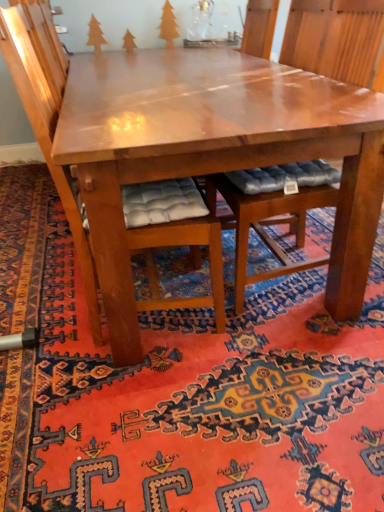
Locate an element on the screen. This screenshot has height=512, width=384. wooden cushioned chair at center, arranged as the first chair when viewed from the right is located at coordinates (334, 37).

Describe the element at coordinates (214, 152) in the screenshot. I see `shiny brown table at center` at that location.

In order to click on wooden tree at upper left, the third tree when ordered from right to left in this screenshot , I will do `click(95, 35)`.

Is carpet with intricate patterns at center bigger or smaller than wooden tree at upper left, the third tree when ordered from right to left?

Clearly, carpet with intricate patterns at center is larger in size than wooden tree at upper left, the third tree when ordered from right to left.

From a real-world perspective, which object stands above the other?

wooden tree at upper left, which is the first tree in left-to-right order, from a real-world perspective.

Is carpet with intricate patterns at center positioned with its back to wooden tree at upper left, which is the first tree in left-to-right order?

That's not correct — carpet with intricate patterns at center is not looking away from wooden tree at upper left, which is the first tree in left-to-right order.

From the image's perspective, is carpet with intricate patterns at center positioned above or below wooden tree at upper left, the third tree when ordered from right to left?

carpet with intricate patterns at center is situated lower than wooden tree at upper left, the third tree when ordered from right to left, in the image.

Considering the relative sizes of matte brown tree at upper center, the 2th tree from the right, and wooden cushioned chair at center, arranged as the first chair when viewed from the right, in the image provided, is matte brown tree at upper center, the 2th tree from the right, bigger than wooden cushioned chair at center, arranged as the first chair when viewed from the right,?

No, matte brown tree at upper center, the 2th tree from the right, is not bigger than wooden cushioned chair at center, arranged as the first chair when viewed from the right.

Is matte brown tree at upper center, which ranks as the second tree in left-to-right order, next to wooden cushioned chair at center, arranged as the first chair when viewed from the right, and touching it?

No, matte brown tree at upper center, which ranks as the second tree in left-to-right order, is not touching wooden cushioned chair at center, arranged as the first chair when viewed from the right.

Which object is further away from the camera taking this photo, matte brown tree at upper center, the 2th tree from the right, or wooden cushioned chair at center, arranged as the first chair when viewed from the right?

matte brown tree at upper center, the 2th tree from the right, is behind.

Is matte brown tree at upper center, which ranks as the second tree in left-to-right order, to the left of wooden cushioned chair at center, arranged as the first chair when viewed from the right, from the viewer's perspective?

Yes, matte brown tree at upper center, which ranks as the second tree in left-to-right order, is to the left of wooden cushioned chair at center, arranged as the first chair when viewed from the right.

Is wooden tree at upper left, the third tree when ordered from right to left, in contact with orange matte tree at upper center, arranged as the first tree when viewed from the right?

No.

Image resolution: width=384 pixels, height=512 pixels. I want to click on tree that is the 2nd object to the right of the wooden tree at upper left, the third tree when ordered from right to left, starting at the anchor, so click(168, 26).

How different are the orientations of wooden tree at upper left, the third tree when ordered from right to left, and orange matte tree at upper center, positioned as the third tree in left-to-right order, in degrees?

The angular difference between wooden tree at upper left, the third tree when ordered from right to left, and orange matte tree at upper center, positioned as the third tree in left-to-right order, is 12 degrees.

Which of these two, wooden tree at upper left, which is the first tree in left-to-right order, or orange matte tree at upper center, positioned as the third tree in left-to-right order, stands taller?

With more height is orange matte tree at upper center, positioned as the third tree in left-to-right order.

Where is `tree to the right of matte brown tree at upper center, the 2th tree from the right`? The width and height of the screenshot is (384, 512). tree to the right of matte brown tree at upper center, the 2th tree from the right is located at coordinates (168, 26).

Can you confirm if orange matte tree at upper center, positioned as the third tree in left-to-right order, is wider than matte brown tree at upper center, which ranks as the second tree in left-to-right order?

Indeed, orange matte tree at upper center, positioned as the third tree in left-to-right order, has a greater width compared to matte brown tree at upper center, which ranks as the second tree in left-to-right order.

Can you confirm if orange matte tree at upper center, arranged as the first tree when viewed from the right, is smaller than matte brown tree at upper center, which ranks as the second tree in left-to-right order?

Actually, orange matte tree at upper center, arranged as the first tree when viewed from the right, might be larger than matte brown tree at upper center, which ranks as the second tree in left-to-right order.

Consider the image. What's the angular difference between wooden cushioned chair at center, which appears as the 2th chair when viewed from the left, and matte brown tree at upper center, the 2th tree from the right,'s facing directions?

There is a 90-degree angle between the facing directions of wooden cushioned chair at center, which appears as the 2th chair when viewed from the left, and matte brown tree at upper center, the 2th tree from the right.

Is wooden cushioned chair at center, arranged as the first chair when viewed from the right, far from matte brown tree at upper center, the 2th tree from the right?

Yes, wooden cushioned chair at center, arranged as the first chair when viewed from the right, is far from matte brown tree at upper center, the 2th tree from the right.

Which point is more distant from viewer, (300, 240) or (133, 40)?

Positioned behind is point (133, 40).

Who is bigger, wooden cushioned chair at center, arranged as the first chair when viewed from the right, or matte brown tree at upper center, which ranks as the second tree in left-to-right order?

wooden cushioned chair at center, arranged as the first chair when viewed from the right.

Find the location of `the 1st chair to the right of the wooden tree at upper left, the third tree when ordered from right to left, starting your count from the anchor`. the 1st chair to the right of the wooden tree at upper left, the third tree when ordered from right to left, starting your count from the anchor is located at coordinates (48, 118).

Can you tell me how much wooden tree at upper left, the third tree when ordered from right to left, and wooden cushioned chair at center, acting as the second chair starting from the right, differ in facing direction?

82.3 degrees.

Is wooden tree at upper left, the third tree when ordered from right to left, positioned before wooden cushioned chair at center, acting as the second chair starting from the right?

No, the depth of wooden tree at upper left, the third tree when ordered from right to left, is greater than that of wooden cushioned chair at center, acting as the second chair starting from the right.

Between point (98, 37) and point (58, 110), which one is positioned behind?

The point (98, 37) is farther from the camera.

Between matte brown tree at upper center, which ranks as the second tree in left-to-right order, and orange matte tree at upper center, arranged as the first tree when viewed from the right, which one has more height?

orange matte tree at upper center, arranged as the first tree when viewed from the right, is taller.

Is orange matte tree at upper center, arranged as the first tree when viewed from the right, inside matte brown tree at upper center, the 2th tree from the right?

That's incorrect, orange matte tree at upper center, arranged as the first tree when viewed from the right, is not inside matte brown tree at upper center, the 2th tree from the right.

Considering the relative sizes of matte brown tree at upper center, which ranks as the second tree in left-to-right order, and orange matte tree at upper center, positioned as the third tree in left-to-right order, in the image provided, is matte brown tree at upper center, which ranks as the second tree in left-to-right order, thinner than orange matte tree at upper center, positioned as the third tree in left-to-right order,?

Correct, the width of matte brown tree at upper center, which ranks as the second tree in left-to-right order, is less than that of orange matte tree at upper center, positioned as the third tree in left-to-right order.

Between point (124, 37) and point (160, 26), which one is positioned in front?

Positioned in front is point (124, 37).

Image resolution: width=384 pixels, height=512 pixels. Find the location of `mat below the wooden tree at upper left, which is the first tree in left-to-right order (from a real-world perspective)`. mat below the wooden tree at upper left, which is the first tree in left-to-right order (from a real-world perspective) is located at coordinates (182, 388).

Image resolution: width=384 pixels, height=512 pixels. In order to click on the 1st chair below when counting from the matte brown tree at upper center, which ranks as the second tree in left-to-right order (from the image's perspective) in this screenshot , I will do `click(334, 37)`.

From the image, which object appears to be nearer to carpet with intricate patterns at center, wooden cushioned chair at center, which appears as the 2th chair when viewed from the left, or shiny brown table at center?

wooden cushioned chair at center, which appears as the 2th chair when viewed from the left, is closer to carpet with intricate patterns at center.

Which object lies nearer to the anchor point matte brown tree at upper center, the 2th tree from the right, wooden cushioned chair at center, acting as the second chair starting from the right, or orange matte tree at upper center, positioned as the third tree in left-to-right order?

Among the two, orange matte tree at upper center, positioned as the third tree in left-to-right order, is located nearer to matte brown tree at upper center, the 2th tree from the right.

Consider the image. When comparing their distances from wooden cushioned chair at center, the first chair in the left-to-right sequence, does matte brown tree at upper center, the 2th tree from the right, or carpet with intricate patterns at center seem further?

matte brown tree at upper center, the 2th tree from the right, is further to wooden cushioned chair at center, the first chair in the left-to-right sequence.

Estimate the real-world distances between objects in this image. Which object is further from orange matte tree at upper center, arranged as the first tree when viewed from the right, wooden tree at upper left, which is the first tree in left-to-right order, or wooden cushioned chair at center, arranged as the first chair when viewed from the right?

wooden cushioned chair at center, arranged as the first chair when viewed from the right, is positioned further to the anchor orange matte tree at upper center, arranged as the first tree when viewed from the right.

Looking at the image, which one is located further to wooden cushioned chair at center, the first chair in the left-to-right sequence, wooden cushioned chair at center, which appears as the 2th chair when viewed from the left, or shiny brown table at center?

Based on the image, wooden cushioned chair at center, which appears as the 2th chair when viewed from the left, appears to be further to wooden cushioned chair at center, the first chair in the left-to-right sequence.

Estimate the real-world distances between objects in this image. Which object is closer to wooden cushioned chair at center, the first chair in the left-to-right sequence, carpet with intricate patterns at center or wooden tree at upper left, the third tree when ordered from right to left?

carpet with intricate patterns at center is closer to wooden cushioned chair at center, the first chair in the left-to-right sequence.

Based on their spatial positions, is wooden tree at upper left, which is the first tree in left-to-right order, or matte brown tree at upper center, which ranks as the second tree in left-to-right order, closer to shiny brown table at center?

Based on the image, matte brown tree at upper center, which ranks as the second tree in left-to-right order, appears to be nearer to shiny brown table at center.

Based on their spatial positions, is wooden cushioned chair at center, arranged as the first chair when viewed from the right, or wooden tree at upper left, which is the first tree in left-to-right order, closer to wooden cushioned chair at center, acting as the second chair starting from the right?

wooden cushioned chair at center, arranged as the first chair when viewed from the right, is positioned closer to the anchor wooden cushioned chair at center, acting as the second chair starting from the right.

At what (x,y) coordinates should I click in order to perform the action: click on chair located between wooden cushioned chair at center, the first chair in the left-to-right sequence, and wooden tree at upper left, the third tree when ordered from right to left, in the depth direction. Please return your answer as a coordinate pair (x, y). The image size is (384, 512). Looking at the image, I should click on (334, 37).

The height and width of the screenshot is (512, 384). Identify the location of tree located between wooden cushioned chair at center, the first chair in the left-to-right sequence, and orange matte tree at upper center, arranged as the first tree when viewed from the right, in the depth direction. coord(95,35).

Where is `table located between wooden cushioned chair at center, acting as the second chair starting from the right, and orange matte tree at upper center, arranged as the first tree when viewed from the right, in the depth direction`? This screenshot has width=384, height=512. table located between wooden cushioned chair at center, acting as the second chair starting from the right, and orange matte tree at upper center, arranged as the first tree when viewed from the right, in the depth direction is located at coordinates (214, 152).

I want to click on tree between carpet with intricate patterns at center and orange matte tree at upper center, arranged as the first tree when viewed from the right, from front to back, so click(x=95, y=35).